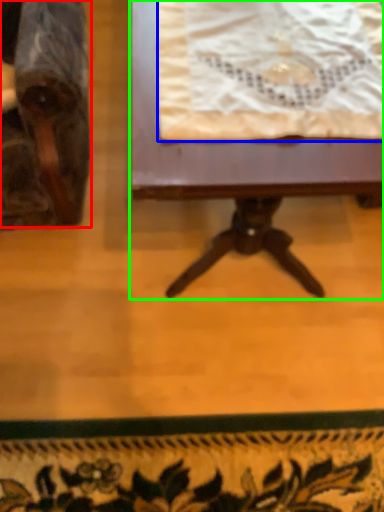
Question: Considering the real-world distances, which object is closest to chair (highlighted by a red box)? blanket (highlighted by a blue box) or table (highlighted by a green box).

Choices:
 (A) blanket
 (B) table

Answer: (B)